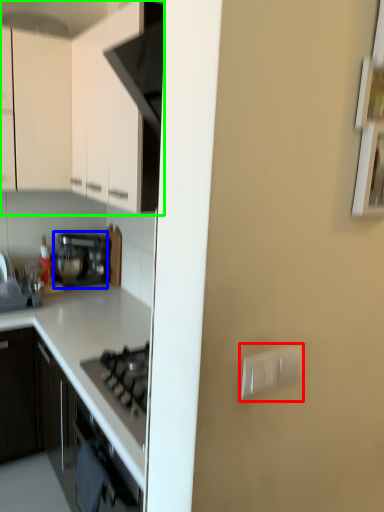
Question: Estimate the real-world distances between objects in this image. Which object is closer to electric outlet (highlighted by a red box), kitchen appliance (highlighted by a blue box) or cabinetry (highlighted by a green box)?

Choices:
 (A) kitchen appliance
 (B) cabinetry

Answer: (B)